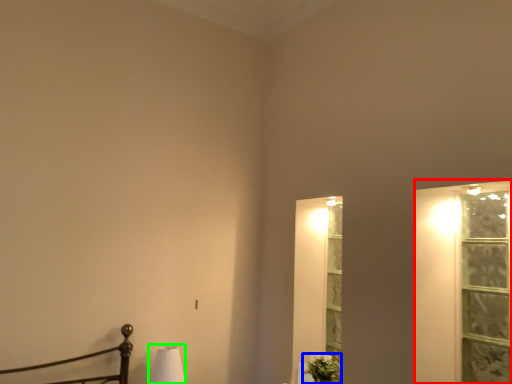
Question: Which object is the closest to the window frame (highlighted by a red box)? Choose among these: plant (highlighted by a blue box) or table lamp (highlighted by a green box).

Choices:
 (A) plant
 (B) table lamp

Answer: (A)